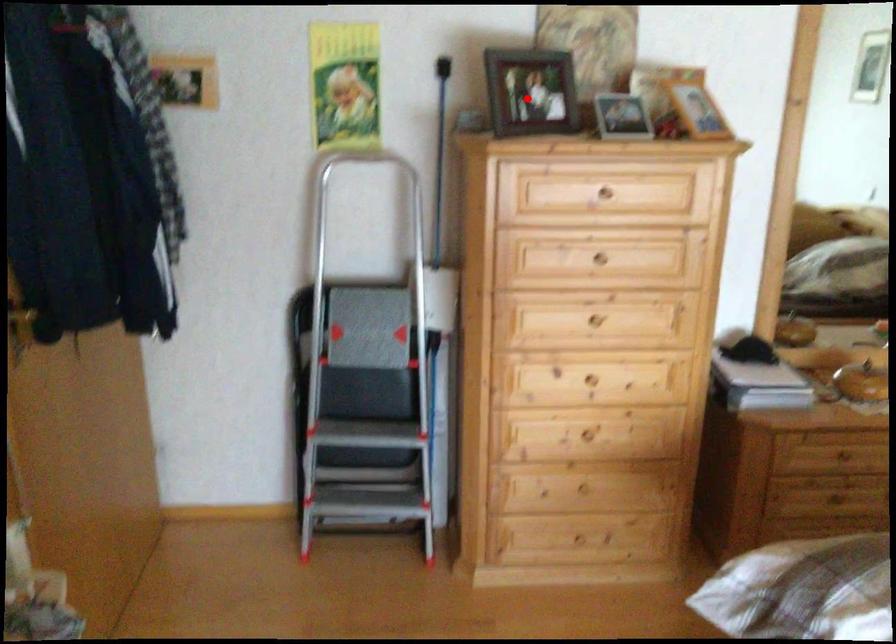
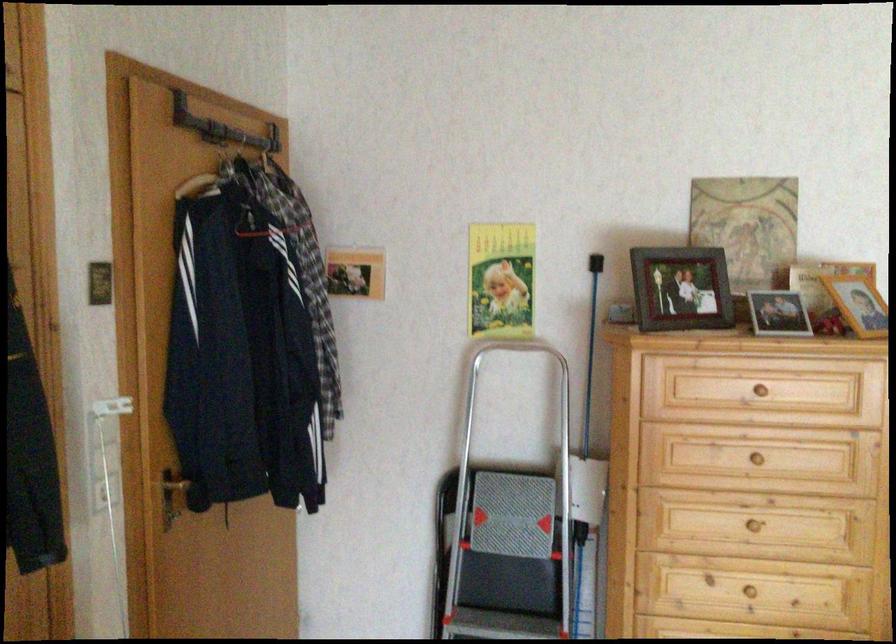
Find the pixel in the second image that matches the highlighted location in the first image.

(681, 289)